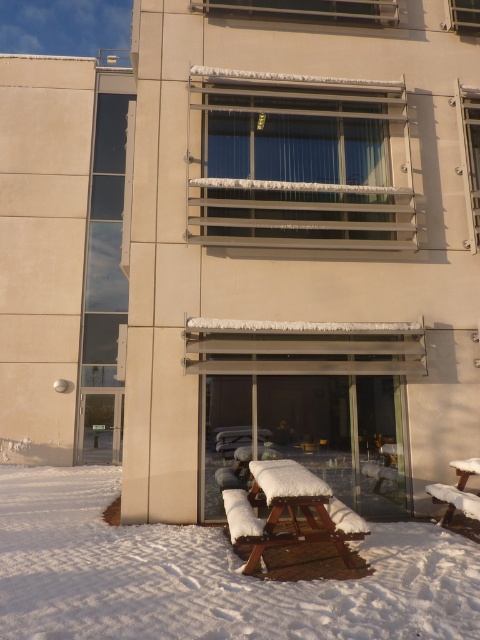
Can you confirm if wooden picnic table at lower center is shorter than snow-covered wood picnic table at lower right?

Incorrect, wooden picnic table at lower center's height does not fall short of snow-covered wood picnic table at lower right's.

This screenshot has width=480, height=640. What do you see at coordinates (288, 512) in the screenshot?
I see `wooden picnic table at lower center` at bounding box center [288, 512].

The height and width of the screenshot is (640, 480). What are the coordinates of `wooden picnic table at lower center` in the screenshot? It's located at (288, 512).

Is white wooden picnic table at lower center to the left of snow-covered wood picnic table at lower right from the viewer's perspective?

Correct, you'll find white wooden picnic table at lower center to the left of snow-covered wood picnic table at lower right.

Who is positioned more to the right, white wooden picnic table at lower center or snow-covered wood picnic table at lower right?

snow-covered wood picnic table at lower right

Locate an element on the screen. white wooden picnic table at lower center is located at coordinates (207, 576).

You are a GUI agent. You are given a task and a screenshot of the screen. Output one action in this format:
    pyautogui.click(x=<x>, y=<y>)
    Task: Click on the white wooden picnic table at lower center
    This screenshot has width=480, height=640.
    Given the screenshot: What is the action you would take?
    pyautogui.click(x=207, y=576)

Does white wooden picnic table at lower center appear on the right side of wooden picnic table at lower center?

No, white wooden picnic table at lower center is not to the right of wooden picnic table at lower center.

Is white wooden picnic table at lower center wider than wooden picnic table at lower center?

Correct, the width of white wooden picnic table at lower center exceeds that of wooden picnic table at lower center.

Is point (468, 564) behind point (340, 506)?

No.

Identify the location of white wooden picnic table at lower center. (207, 576).